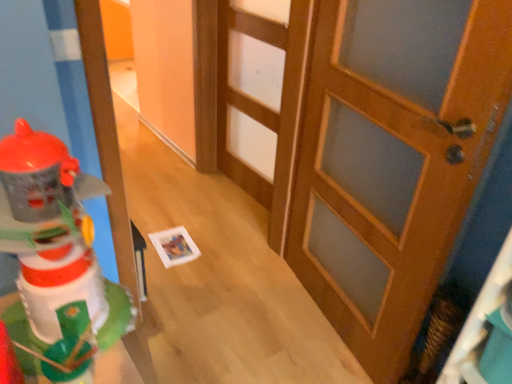
Question: Is wooden door at center, the 2th door positioned from the front, positioned with its back to plastic toy robot at left?

Choices:
 (A) yes
 (B) no

Answer: (B)

Question: Does wooden door at center, the 1th door from the back, turn towards plastic toy robot at left?

Choices:
 (A) yes
 (B) no

Answer: (B)

Question: Is wooden door at center, the second door viewed from the right, thinner than plastic toy robot at left?

Choices:
 (A) yes
 (B) no

Answer: (A)

Question: Is wooden door at center, the second door viewed from the right, taller than plastic toy robot at left?

Choices:
 (A) no
 (B) yes

Answer: (B)

Question: Is wooden door at center, the 1th door viewed from the left, to the right of plastic toy robot at left from the viewer's perspective?

Choices:
 (A) yes
 (B) no

Answer: (A)

Question: Is point (257, 168) positioned closer to the camera than point (316, 76)?

Choices:
 (A) farther
 (B) closer

Answer: (A)

Question: Looking at their shapes, would you say wooden door at center, the 2th door positioned from the front, is wider or thinner than wooden door at center, the first door in the front-to-back sequence?

Choices:
 (A) thin
 (B) wide

Answer: (A)

Question: Visually, is wooden door at center, the second door viewed from the right, positioned to the left or to the right of wooden door at center, arranged as the 1th door when viewed from the right?

Choices:
 (A) left
 (B) right

Answer: (A)

Question: From the image's perspective, relative to wooden door at center, which is counted as the 2th door, starting from the left, is wooden door at center, the 1th door viewed from the left, above or below?

Choices:
 (A) above
 (B) below

Answer: (A)

Question: From a real-world perspective, is plastic toy robot at left physically located above or below wooden door at center, the first door in the front-to-back sequence?

Choices:
 (A) above
 (B) below

Answer: (A)

Question: In the image, is plastic toy robot at left positioned in front of or behind wooden door at center, which is counted as the 2th door, starting from the left?

Choices:
 (A) behind
 (B) front

Answer: (B)

Question: Considering the positions of point (39, 150) and point (399, 372), is point (39, 150) closer or farther from the camera than point (399, 372)?

Choices:
 (A) farther
 (B) closer

Answer: (B)

Question: From the image's perspective, is plastic toy robot at left above or below wooden door at center, which is counted as the 2th door, starting from the left?

Choices:
 (A) below
 (B) above

Answer: (A)

Question: Looking at their shapes, would you say plastic toy robot at left is wider or thinner than wooden door at center, the 1th door viewed from the left?

Choices:
 (A) wide
 (B) thin

Answer: (A)

Question: From the image's perspective, is plastic toy robot at left above or below wooden door at center, the second door viewed from the right?

Choices:
 (A) below
 (B) above

Answer: (A)